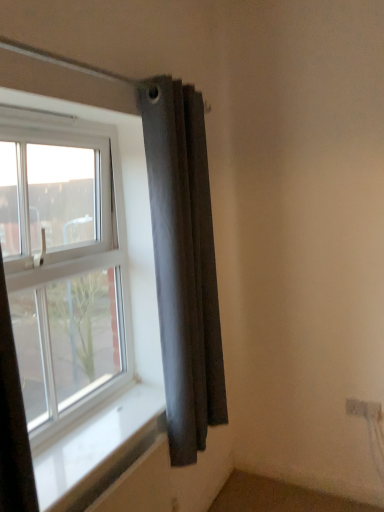
Question: From the image's perspective, would you say white smooth window sill at lower left is positioned over dark gray fabric curtain at upper right?

Choices:
 (A) yes
 (B) no

Answer: (B)

Question: Is white smooth window sill at lower left far away from dark gray fabric curtain at upper right?

Choices:
 (A) no
 (B) yes

Answer: (A)

Question: From the image's perspective, is white smooth window sill at lower left beneath dark gray fabric curtain at upper right?

Choices:
 (A) no
 (B) yes

Answer: (B)

Question: Does white smooth window sill at lower left have a smaller size compared to dark gray fabric curtain at upper right?

Choices:
 (A) yes
 (B) no

Answer: (A)

Question: Can you confirm if white smooth window sill at lower left is bigger than dark gray fabric curtain at upper right?

Choices:
 (A) no
 (B) yes

Answer: (A)

Question: Is point (3, 212) closer or farther from the camera than point (122, 416)?

Choices:
 (A) closer
 (B) farther

Answer: (A)

Question: Relative to white smooth window sill at lower left, is white plastic window at upper left in front or behind?

Choices:
 (A) behind
 (B) front

Answer: (A)

Question: From a real-world perspective, is white plastic window at upper left above or below white smooth window sill at lower left?

Choices:
 (A) above
 (B) below

Answer: (A)

Question: From the image's perspective, is white plastic window at upper left located above or below white smooth window sill at lower left?

Choices:
 (A) below
 (B) above

Answer: (B)

Question: Is white smooth window sill at lower left taller or shorter than white plastic window at upper left?

Choices:
 (A) short
 (B) tall

Answer: (A)

Question: Is point (94, 460) positioned closer to the camera than point (44, 368)?

Choices:
 (A) closer
 (B) farther

Answer: (A)

Question: Is white smooth window sill at lower left bigger or smaller than white plastic window at upper left?

Choices:
 (A) big
 (B) small

Answer: (B)

Question: In terms of width, does white smooth window sill at lower left look wider or thinner when compared to white plastic window at upper left?

Choices:
 (A) thin
 (B) wide

Answer: (B)

Question: From a real-world perspective, relative to white smooth window sill at lower left, is dark gray fabric curtain at upper right vertically above or below?

Choices:
 (A) above
 (B) below

Answer: (A)

Question: In the image, is dark gray fabric curtain at upper right positioned in front of or behind white smooth window sill at lower left?

Choices:
 (A) front
 (B) behind

Answer: (B)